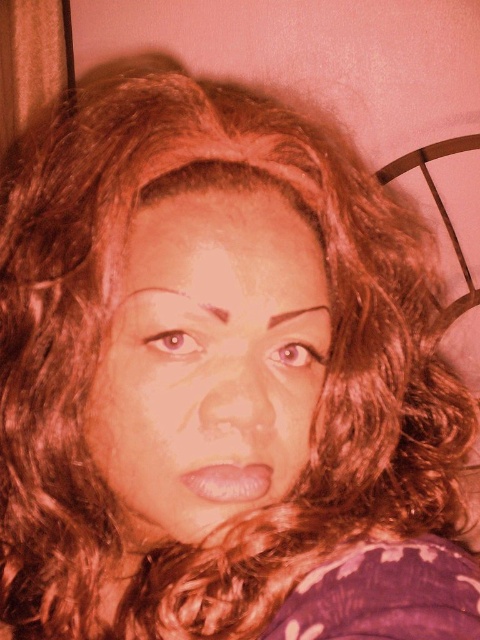
What do you see at coordinates (207, 362) in the screenshot? I see `matte skin face at center` at bounding box center [207, 362].

Where is `matte skin face at center`? This screenshot has height=640, width=480. matte skin face at center is located at coordinates (207, 362).

Measure the distance from smooth skin at center to brown matte eye at upper left.

smooth skin at center is 1.85 inches from brown matte eye at upper left.

Between smooth skin at center and brown matte eye at upper left, which one is positioned lower?

Positioned lower is brown matte eye at upper left.

Locate an element on the screen. This screenshot has width=480, height=640. smooth skin at center is located at coordinates (226, 250).

Does light brown eye at center appear on the right side of brown matte eyebrow at center?

No, light brown eye at center is not to the right of brown matte eyebrow at center.

Is light brown eye at center further to the viewer compared to brown matte eyebrow at center?

Yes, light brown eye at center is behind brown matte eyebrow at center.

Between point (274, 355) and point (274, 324), which one is positioned behind?

The point (274, 355) is behind.

Find the location of a particular element. The width and height of the screenshot is (480, 640). light brown eye at center is located at coordinates pyautogui.click(x=296, y=355).